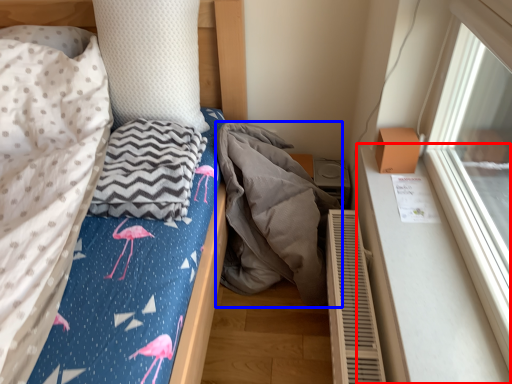
Question: Which object is closer to the camera taking this photo, window sill (highlighted by a red box) or material (highlighted by a blue box)?

Choices:
 (A) window sill
 (B) material

Answer: (A)